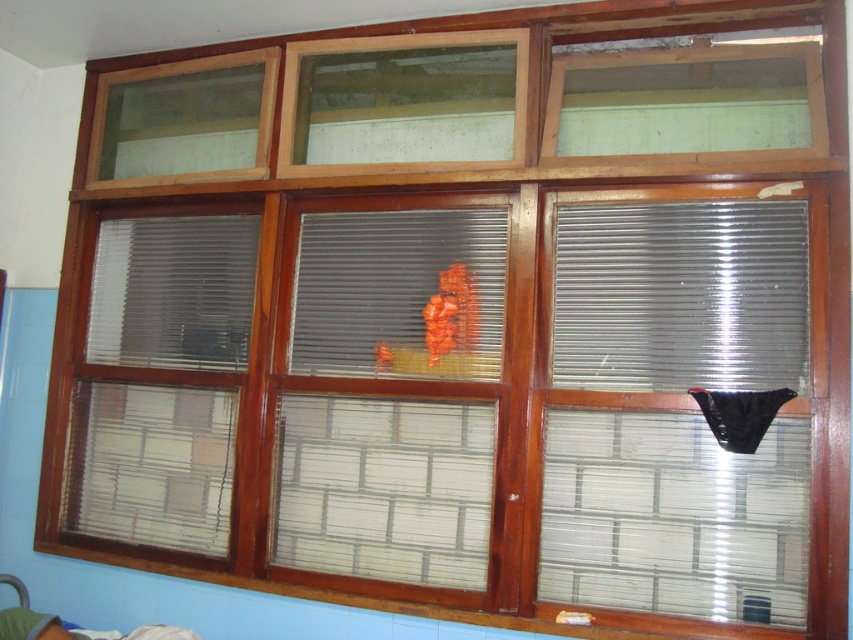
You are standing in a room with a large window divided into panes. You notice a point at coordinates point (635,324). If you want to place a small sticker exactly halfway between them, where should you place it?

The sticker should be placed at the midpoint between the two points, which is calculated by averaging their coordinates. Since the distance between them is 2.54 meters, the midpoint would be at 1.27 meters from each point.

You are standing in a room with a large window and a bed. You need to determine if the translucent plastic blind at center can be seen from the green fabric bed at lower left. Based on their positions and the window structure described, is the blind visible from the bed?

The translucent plastic blind at center is taller than the green fabric bed at lower left, so it is possible that the blind is visible from the bed depending on the bed position and angle. However, the window has horizontal blinds partially covering the lower section where the bed is located, which might block the view. The exact visibility cannot be determined without more information about the bed and blind positions relative to each other.

You are trying to adjust the blinds in the window to let in more light. You have two options, the metallic corrugated blind at right and the translucent plastic blind at center. Which blind should you move to the left to create space between them?

The metallic corrugated blind at right is positioned on the right side of translucent plastic blind at center. To create space between them, you should move the metallic corrugated blind at right to the left.